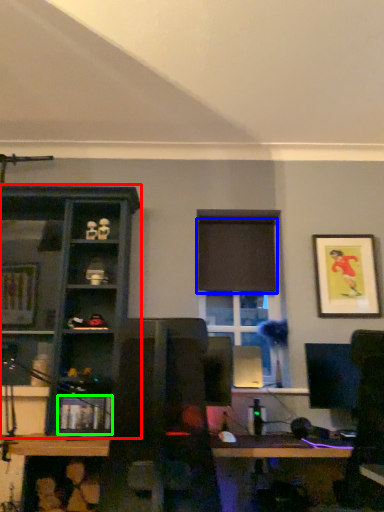
Question: Based on their relative distances, which object is farther from shelf (highlighted by a red box)? Choose from curtain (highlighted by a blue box) and shelf (highlighted by a green box).

Choices:
 (A) curtain
 (B) shelf

Answer: (A)